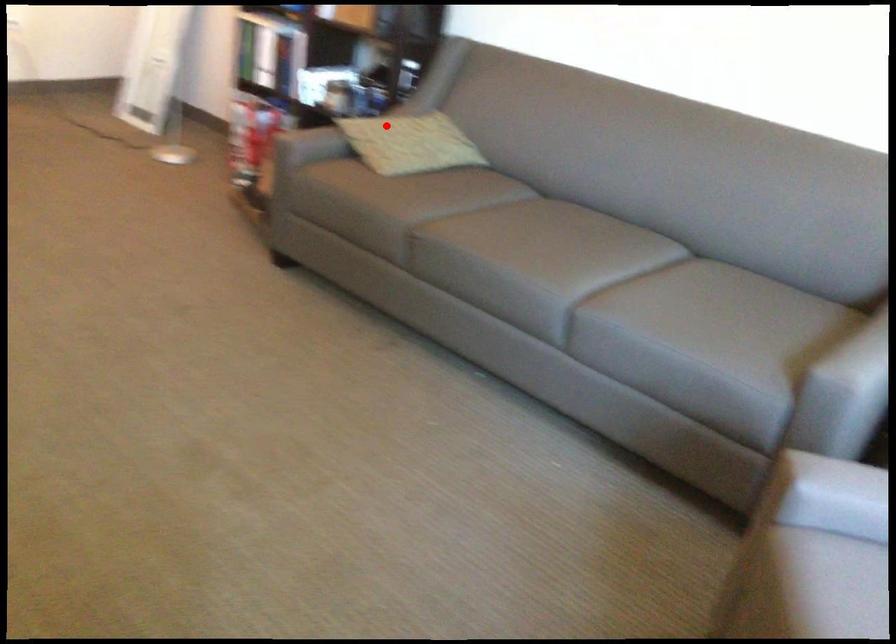
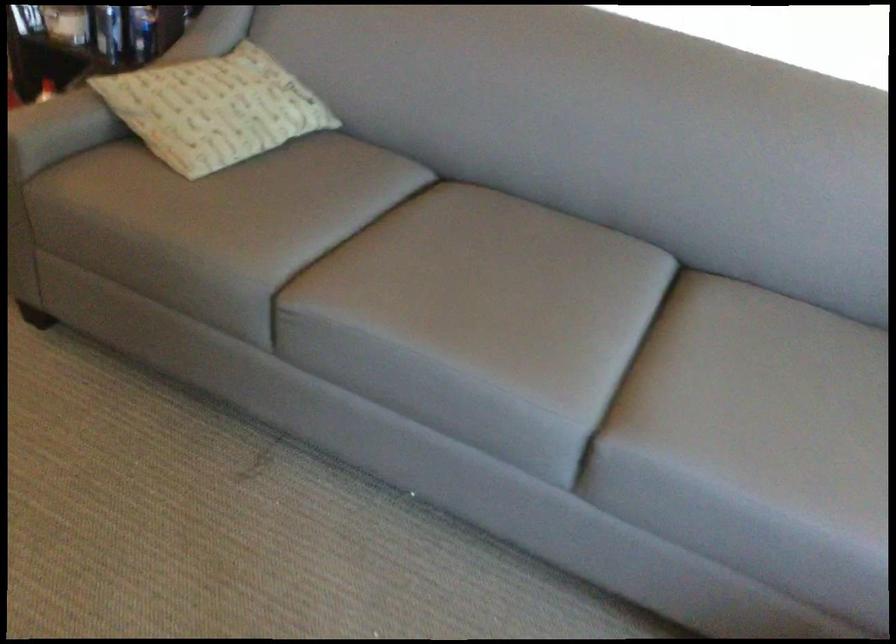
Locate, in the second image, the point that corresponds to the highlighted location in the first image.

(214, 93)